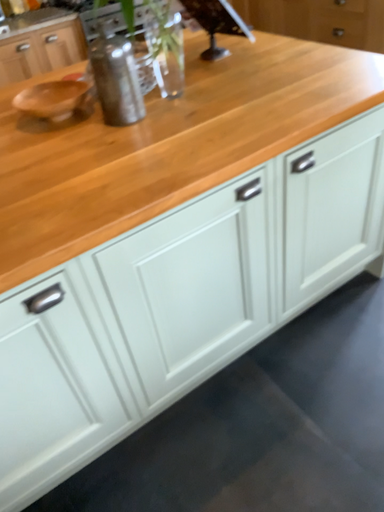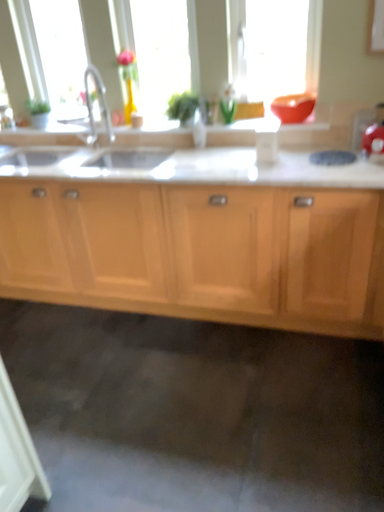
Question: Which way did the camera rotate in the video?

Choices:
 (A) rotated upward
 (B) rotated downward

Answer: (A)